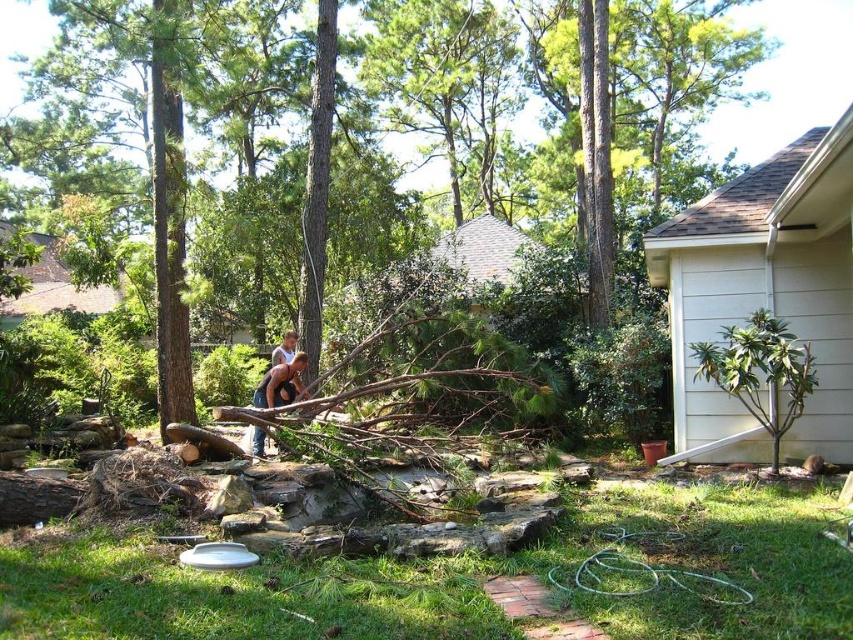
You are a gardener standing at the edge of the stone pathway. You see the brown leather boots at center and the brown rough wood at center. Which object is taller?

The brown rough wood at center is taller than the brown leather boots at center.